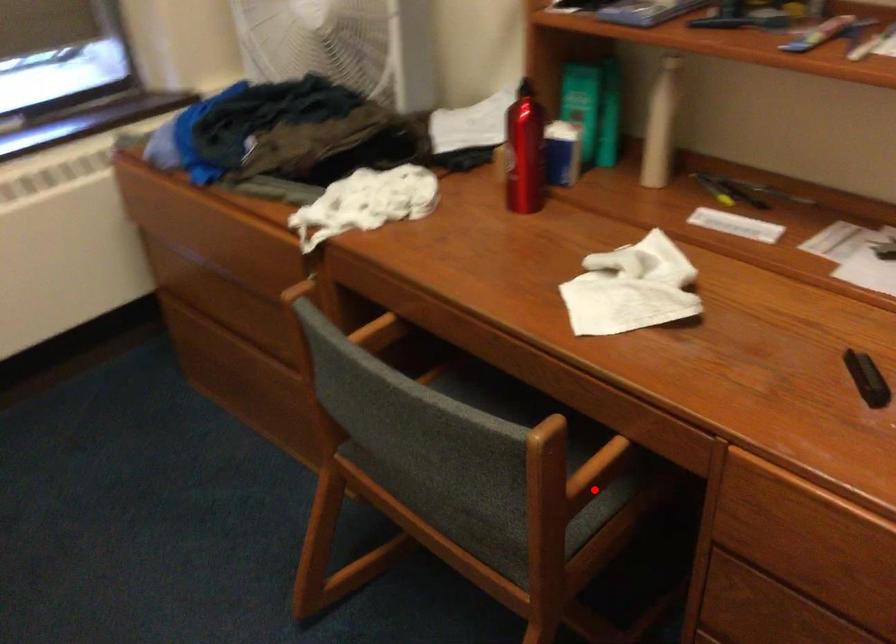
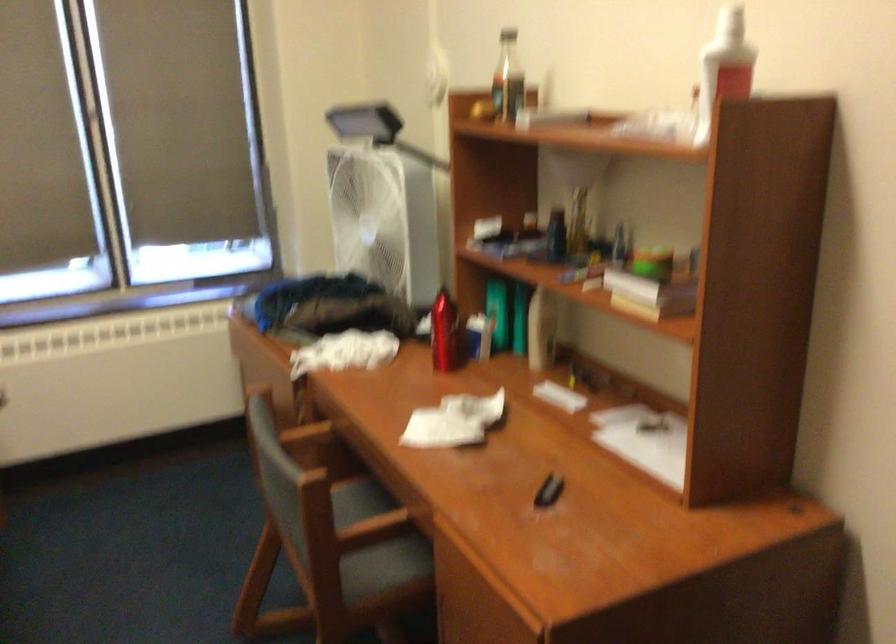
Question: I am providing you with two images of the same scene from different viewpoints. In image1, a red point is highlighted. Considering the same 3D point in image2, which of the following is correct?

Choices:
 (A) It is closer
 (B) It is farther

Answer: (B)